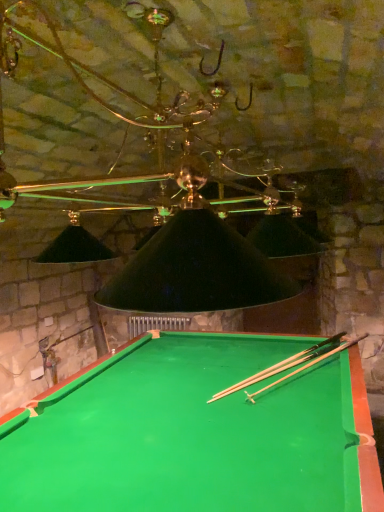
Question: Based on their positions, is green felt billiard table at center located to the left or right of wooden cue at center?

Choices:
 (A) right
 (B) left

Answer: (B)

Question: Would you say green felt billiard table at center is inside or outside wooden cue at center?

Choices:
 (A) inside
 (B) outside

Answer: (B)

Question: Is green felt billiard table at center bigger or smaller than wooden cue at center?

Choices:
 (A) big
 (B) small

Answer: (A)

Question: Is wooden cue at center taller or shorter than green felt billiard table at center?

Choices:
 (A) short
 (B) tall

Answer: (A)

Question: Considering the positions of wooden cue at center and green felt billiard table at center in the image, is wooden cue at center bigger or smaller than green felt billiard table at center?

Choices:
 (A) small
 (B) big

Answer: (A)

Question: Is wooden cue at center in front of or behind green felt billiard table at center in the image?

Choices:
 (A) behind
 (B) front

Answer: (A)

Question: From the image's perspective, is wooden cue at center above or below green felt billiard table at center?

Choices:
 (A) above
 (B) below

Answer: (A)